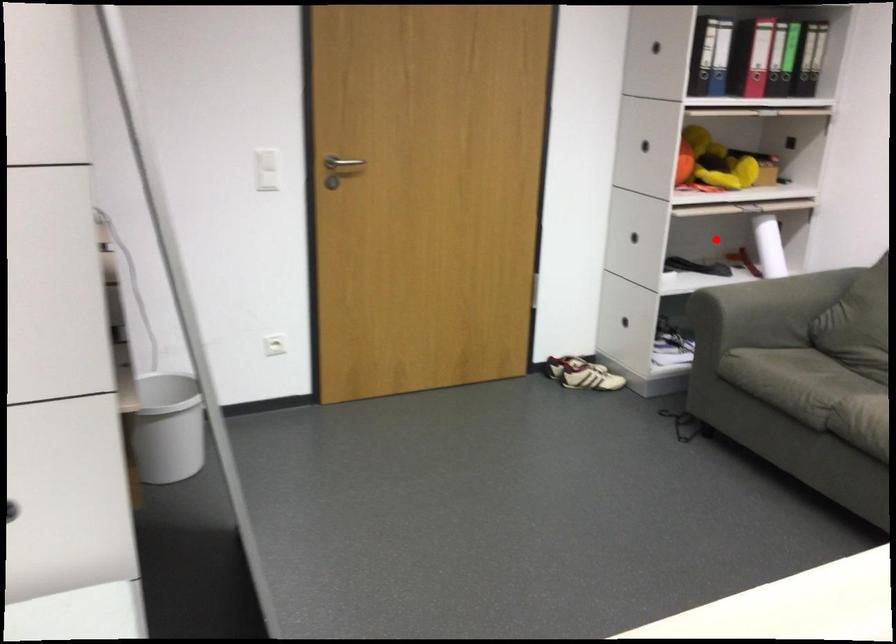
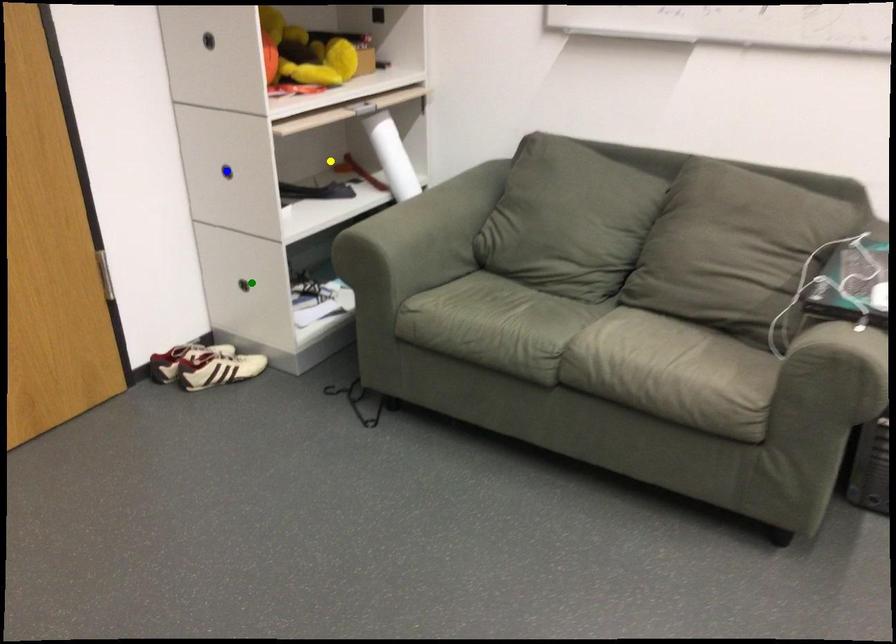
Question: I am providing you with two images of the same scene from different viewpoints. A red point is marked on the first image. You are given multiple points on the second image. Which mark in image 2 goes with the point in image 1?

Choices:
 (A) blue point
 (B) green point
 (C) yellow point

Answer: (C)